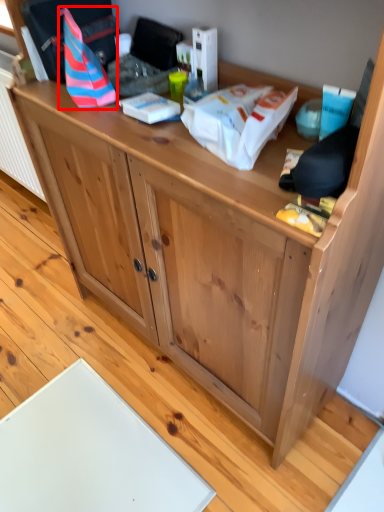
Question: Observing the image, what is the correct spatial positioning of kit (annotated by the red box) in reference to kit?

Choices:
 (A) left
 (B) right

Answer: (A)